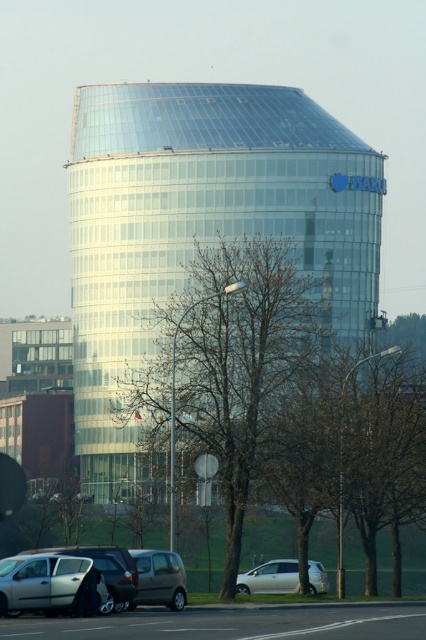
Question: Estimate the real-world distances between objects in this image. Which object is farther from the bare branches at center?

Choices:
 (A) transparent glass tower at center
 (B) silver metallic sedan at lower left
 (C) white matte van at lower center

Answer: (B)

Question: Which point is farther from the camera taking this photo?

Choices:
 (A) (8, 570)
 (B) (278, 560)
 (C) (149, 554)

Answer: (B)

Question: Can you confirm if metallic gray van at lower left is wider than white matte van at lower center?

Choices:
 (A) yes
 (B) no

Answer: (B)

Question: Can you confirm if transparent glass tower at center is positioned above metallic gray van at lower left?

Choices:
 (A) no
 (B) yes

Answer: (B)

Question: Which point is closer to the camera?

Choices:
 (A) bare branches at center
 (B) transparent glass tower at center
 (C) white matte van at lower center
 (D) silver metallic sedan at lower left

Answer: (D)

Question: Can you confirm if transparent glass tower at center is bigger than bare branches at center?

Choices:
 (A) yes
 (B) no

Answer: (A)